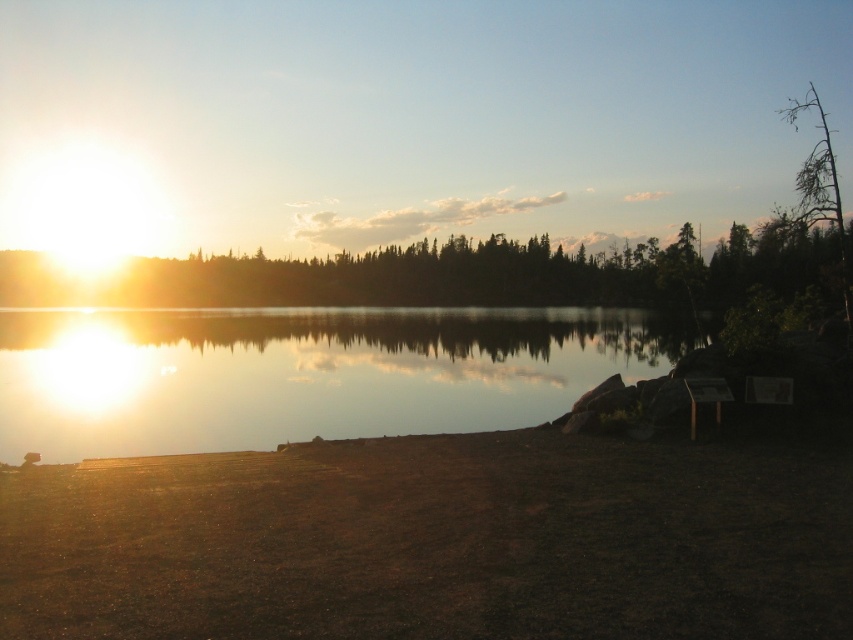
Question: Is glistening water at center closer to camera compared to green leafy tree at upper center?

Choices:
 (A) yes
 (B) no

Answer: (A)

Question: Among these points, which one is nearest to the camera?

Choices:
 (A) 187,435
 (B) 764,276

Answer: (A)

Question: Does glistening water at center have a lesser width compared to green leafy tree at upper center?

Choices:
 (A) no
 (B) yes

Answer: (B)

Question: Which point is farther to the camera?

Choices:
 (A) (143, 333)
 (B) (265, 288)

Answer: (B)

Question: Is glistening water at center behind green leafy tree at upper center?

Choices:
 (A) no
 (B) yes

Answer: (A)